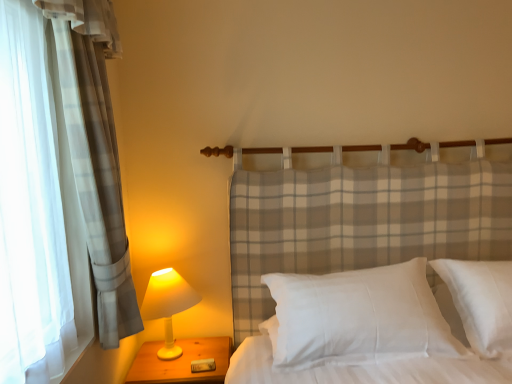
Find the location of a particular element. Image resolution: width=512 pixels, height=384 pixels. blank area beneath white matte lamp at left (from a real-world perspective) is located at coordinates (172, 348).